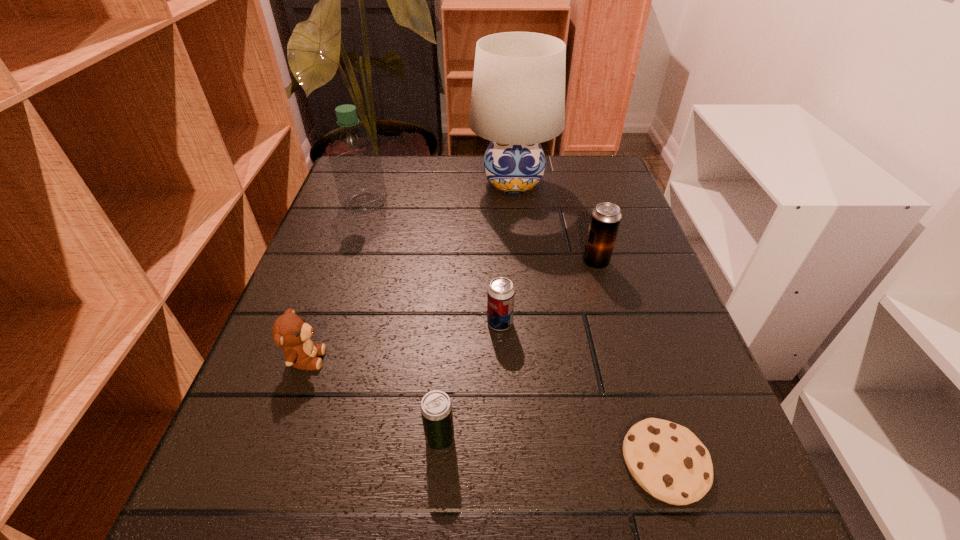
Find the location of `vacant space that's between the teddy bear and the tallest object`. vacant space that's between the teddy bear and the tallest object is located at coordinates (410, 271).

This screenshot has width=960, height=540. In order to click on blank region between the fourth nearest object and the teddy bear in this screenshot , I will do `click(403, 341)`.

Where is `empty location between the fourth farthest object and the tallest beer can`? The width and height of the screenshot is (960, 540). empty location between the fourth farthest object and the tallest beer can is located at coordinates (548, 293).

At what (x,y) coordinates should I click in order to perform the action: click on unoccupied area between the fifth nearest object and the fifth object from right to left. Please return your answer as a coordinate pair (x, y). This screenshot has width=960, height=540. Looking at the image, I should click on (518, 350).

What are the coordinates of `object that stands as the third closest to the second tallest object` in the screenshot? It's located at (501, 293).

Locate an element on the screen. The height and width of the screenshot is (540, 960). the third closest object to the lampshade is located at coordinates (501, 293).

What are the coordinates of `beer can identified as the second closest to the leftmost beer can` in the screenshot? It's located at (605, 220).

The width and height of the screenshot is (960, 540). Identify the location of beer can that is the closest to the teddy bear. (436, 408).

The width and height of the screenshot is (960, 540). In order to click on vacant area that satisfies the following two spatial constraints: 1. on the front side of the fifth object from right to left; 2. on the left side of the second tallest object in this screenshot , I will do `click(285, 438)`.

This screenshot has height=540, width=960. Find the location of `vacant space that satisfies the following two spatial constraints: 1. on the front-facing side of the lampshade; 2. on the face of the fifth farthest object`. vacant space that satisfies the following two spatial constraints: 1. on the front-facing side of the lampshade; 2. on the face of the fifth farthest object is located at coordinates pos(532,359).